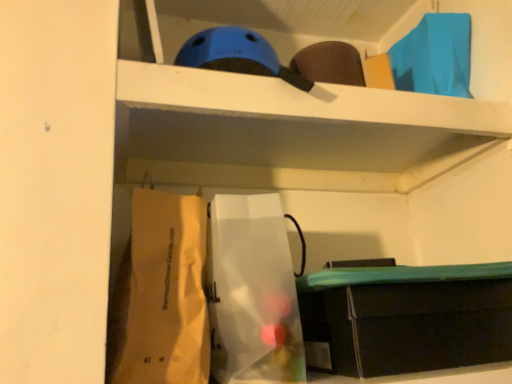
Question: Is matte black storage box at lower right bigger than white paper bag at lower left, marked as the 1th paper bag in a left-to-right arrangement?

Choices:
 (A) yes
 (B) no

Answer: (A)

Question: Could you tell me if matte black storage box at lower right is facing white paper bag at lower left, marked as the 1th paper bag in a left-to-right arrangement?

Choices:
 (A) no
 (B) yes

Answer: (A)

Question: Is matte black storage box at lower right in front of white paper bag at lower left, marked as the 1th paper bag in a left-to-right arrangement?

Choices:
 (A) no
 (B) yes

Answer: (A)

Question: Considering the relative sizes of matte black storage box at lower right and white paper bag at lower left, marked as the 1th paper bag in a left-to-right arrangement, in the image provided, is matte black storage box at lower right wider than white paper bag at lower left, marked as the 1th paper bag in a left-to-right arrangement,?

Choices:
 (A) yes
 (B) no

Answer: (A)

Question: Is matte black storage box at lower right taller than white paper bag at lower left, marked as the 1th paper bag in a left-to-right arrangement?

Choices:
 (A) yes
 (B) no

Answer: (B)

Question: Is matte black storage box at lower right beside white paper bag at lower left, arranged as the 2th paper bag when viewed from the right?

Choices:
 (A) yes
 (B) no

Answer: (B)

Question: Is translucent plastic bag at center, the second paper bag viewed from the left, located outside white paper bag at lower left, marked as the 1th paper bag in a left-to-right arrangement?

Choices:
 (A) yes
 (B) no

Answer: (A)

Question: Is white paper bag at lower left, arranged as the 2th paper bag when viewed from the right, completely or partially inside translucent plastic bag at center, the first paper bag when ordered from right to left?

Choices:
 (A) no
 (B) yes

Answer: (A)

Question: Is translucent plastic bag at center, the first paper bag when ordered from right to left, closer to the viewer compared to white paper bag at lower left, arranged as the 2th paper bag when viewed from the right?

Choices:
 (A) yes
 (B) no

Answer: (B)

Question: Is translucent plastic bag at center, the first paper bag when ordered from right to left, turned away from white paper bag at lower left, arranged as the 2th paper bag when viewed from the right?

Choices:
 (A) yes
 (B) no

Answer: (B)

Question: Is translucent plastic bag at center, the first paper bag when ordered from right to left, bigger than white paper bag at lower left, arranged as the 2th paper bag when viewed from the right?

Choices:
 (A) yes
 (B) no

Answer: (A)

Question: Does translucent plastic bag at center, the first paper bag when ordered from right to left, have a lesser height compared to white paper bag at lower left, arranged as the 2th paper bag when viewed from the right?

Choices:
 (A) yes
 (B) no

Answer: (B)

Question: Is matte black storage box at lower right facing towards translucent plastic bag at center, the first paper bag when ordered from right to left?

Choices:
 (A) yes
 (B) no

Answer: (B)